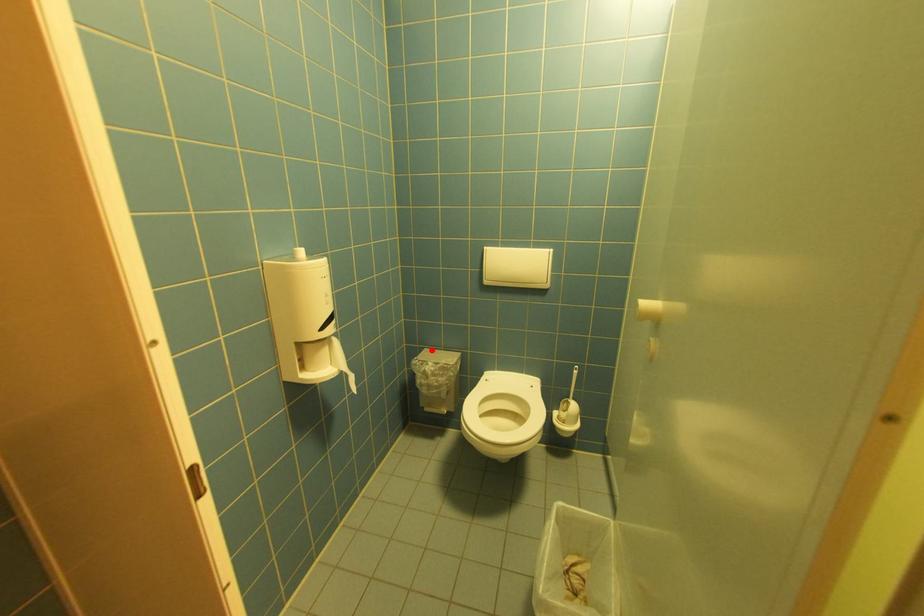
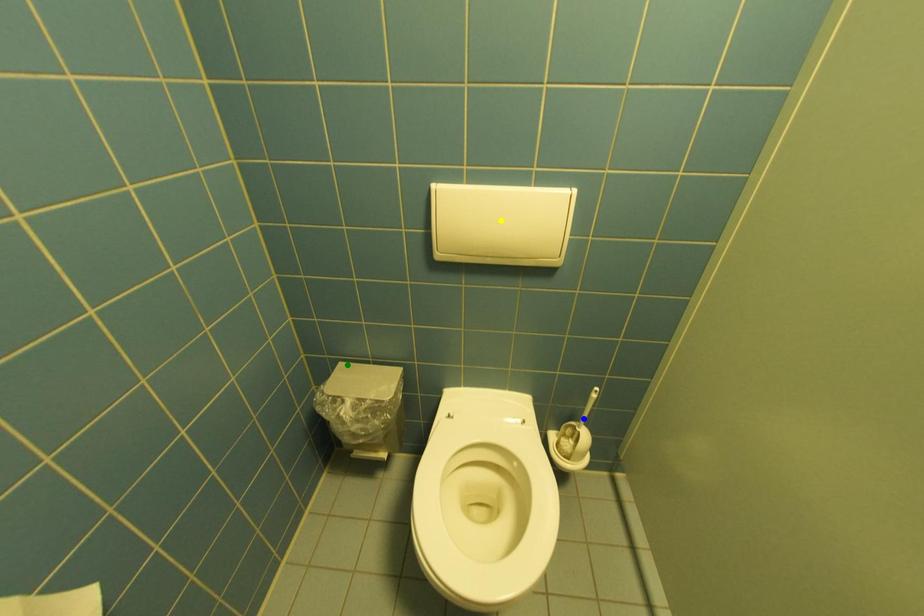
Question: I am providing you with two images of the same scene from different viewpoints. A red point is marked on the first image. You are given multiple points on the second image. Which point in image 2 represents the same 3d spot as the red point in image 1?

Choices:
 (A) yellow point
 (B) blue point
 (C) green point

Answer: (C)